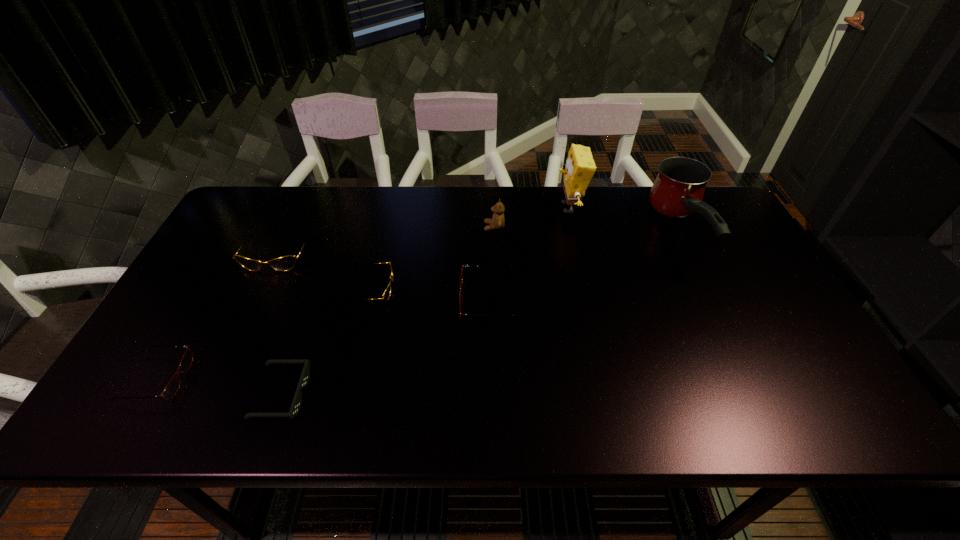
Find the location of a particular element. vacant space at the far left corner is located at coordinates (259, 201).

Where is `vacant space at the near right corner of the desktop`? This screenshot has width=960, height=540. vacant space at the near right corner of the desktop is located at coordinates (776, 397).

At what (x,y) coordinates should I click in order to perform the action: click on free space that is in between the saucepan and the left gold spectacles. Please return your answer as a coordinate pair (x, y). Image resolution: width=960 pixels, height=540 pixels. Looking at the image, I should click on (479, 243).

I want to click on free space that is in between the nearest spectacles and the sixth shortest object, so click(325, 303).

I want to click on free spot between the second tallest object and the nearest spectacles, so click(420, 305).

Where is `vacant space that's between the farther red spectacles and the sixth shortest object`? vacant space that's between the farther red spectacles and the sixth shortest object is located at coordinates (492, 264).

You are a GUI agent. You are given a task and a screenshot of the screen. Output one action in this format:
    pyautogui.click(x=<x>, y=<y>)
    Task: Click on the vacant space that's between the sunglasses and the saucepan
    This screenshot has height=540, width=960.
    Given the screenshot: What is the action you would take?
    pyautogui.click(x=482, y=313)

At what (x,y) coordinates should I click in order to perform the action: click on free area in between the third spectacles from left to right and the teddy bear. Please return your answer as a coordinate pair (x, y). The height and width of the screenshot is (540, 960). Looking at the image, I should click on (433, 258).

Locate an element on the screen. empty location between the smaller gold spectacles and the teddy bear is located at coordinates (433, 258).

Locate an element on the screen. vacant region between the fourth object from left to right and the teddy bear is located at coordinates (433, 258).